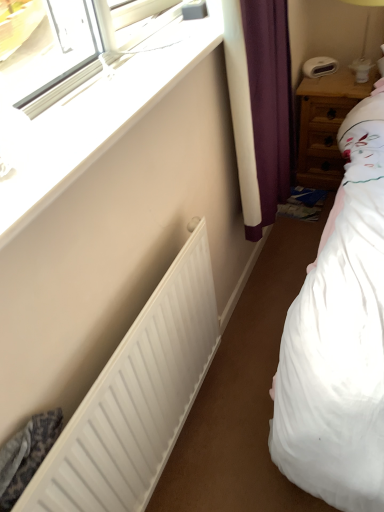
Where is `empty space that is ontop of white plastic window at upper left (from a real-world perspective)`? The height and width of the screenshot is (512, 384). empty space that is ontop of white plastic window at upper left (from a real-world perspective) is located at coordinates (110, 87).